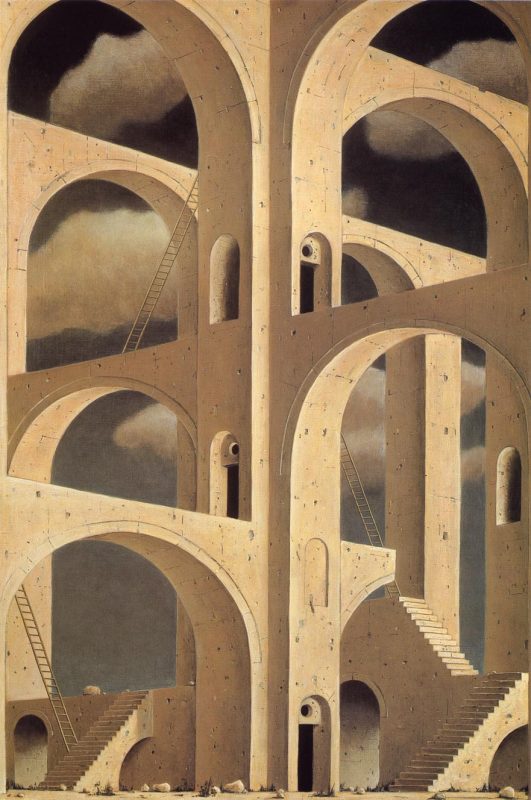
I want to click on bottom staircase, so click(x=99, y=748), click(x=463, y=726).